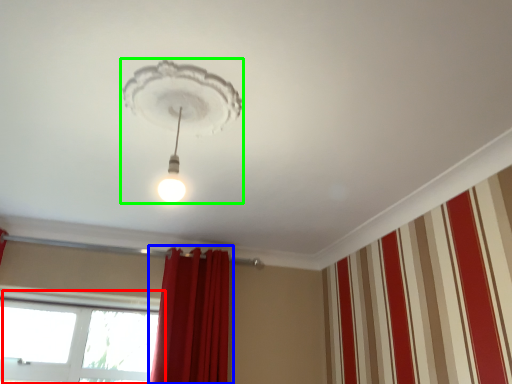
Question: Which is farther away from window (highlighted by a red box)? curtain (highlighted by a blue box) or lamp (highlighted by a green box)?

Choices:
 (A) curtain
 (B) lamp

Answer: (B)